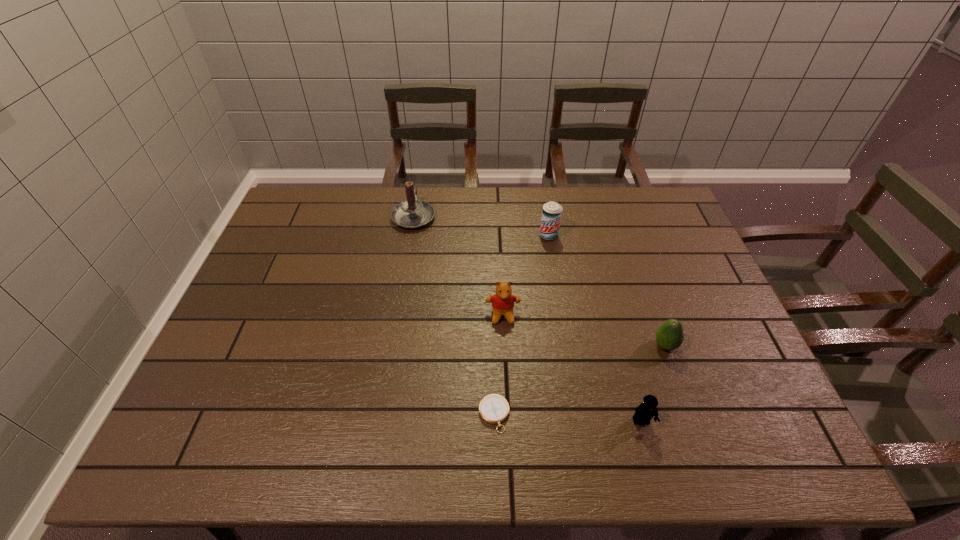
In the image, there is a desktop. Identify the location of free space at the near left corner. (236, 447).

In order to click on free spot at the far right corner of the desktop in this screenshot , I will do `click(627, 195)`.

Identify the location of free spot at the near right corner of the desktop. Image resolution: width=960 pixels, height=540 pixels. click(x=745, y=429).

The width and height of the screenshot is (960, 540). I want to click on free space between the fifth object from left to right and the shortest object, so click(x=567, y=418).

At what (x,y) coordinates should I click in order to perform the action: click on vacant point located between the Lego and the fourth object from left to right. Please return your answer as a coordinate pair (x, y). The image size is (960, 540). Looking at the image, I should click on (595, 328).

At what (x,y) coordinates should I click in order to perform the action: click on free space between the compass and the fourth object from left to right. Please return your answer as a coordinate pair (x, y). This screenshot has height=540, width=960. Looking at the image, I should click on (521, 325).

At what (x,y) coordinates should I click in order to perform the action: click on free space between the beer can and the rightmost object. Please return your answer as a coordinate pair (x, y). The image size is (960, 540). Looking at the image, I should click on (607, 291).

You are a GUI agent. You are given a task and a screenshot of the screen. Output one action in this format:
    pyautogui.click(x=<x>, y=<y>)
    Task: Click on the free point between the fourth object from left to right and the shortest object
    This screenshot has width=960, height=540.
    Given the screenshot: What is the action you would take?
    pyautogui.click(x=521, y=325)

I want to click on empty space that is in between the shortest object and the fourth nearest object, so click(498, 365).

Identify the location of unoccupied area between the tallest object and the Lego. The width and height of the screenshot is (960, 540). (527, 319).